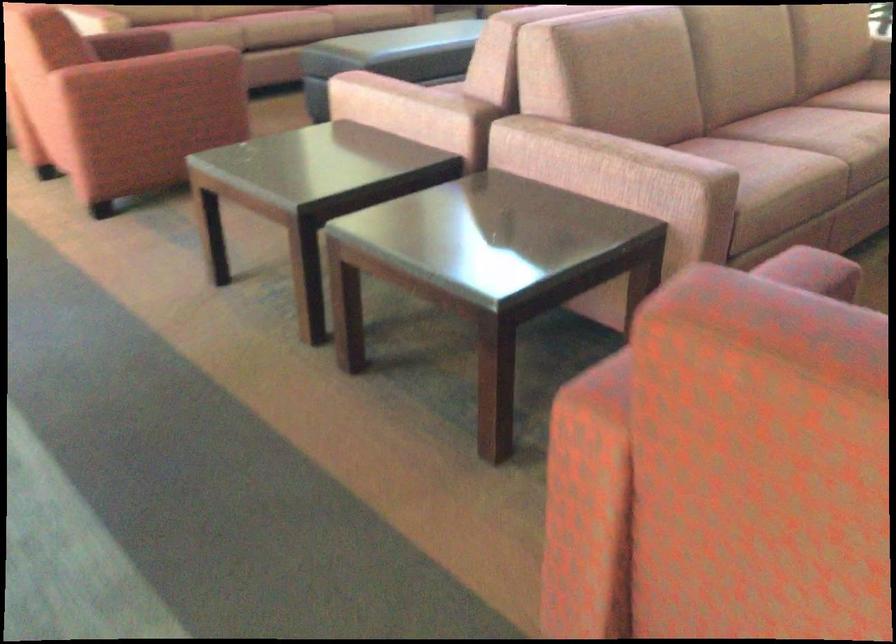
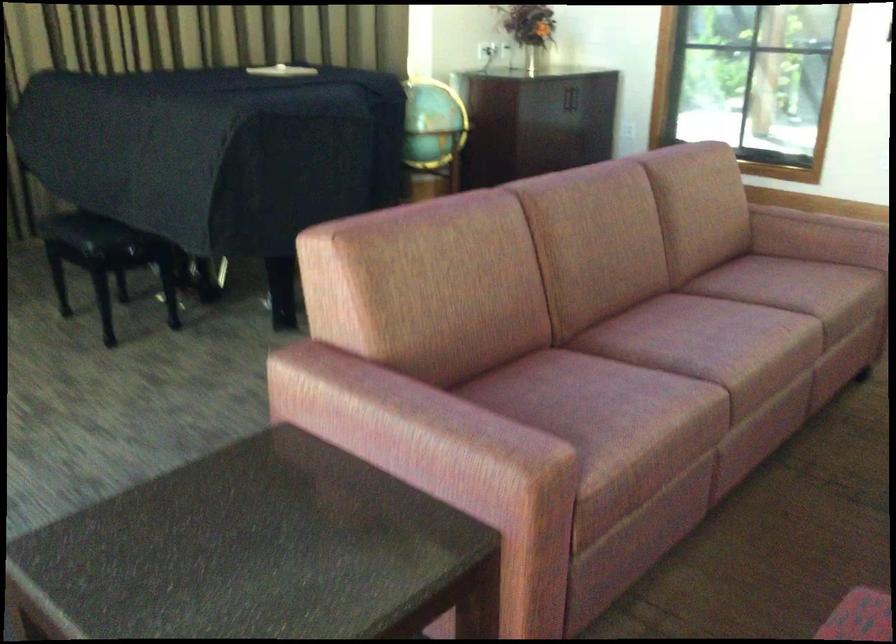
What movement of the cameraman would produce the second image?

The cameraman moved toward left, forward.